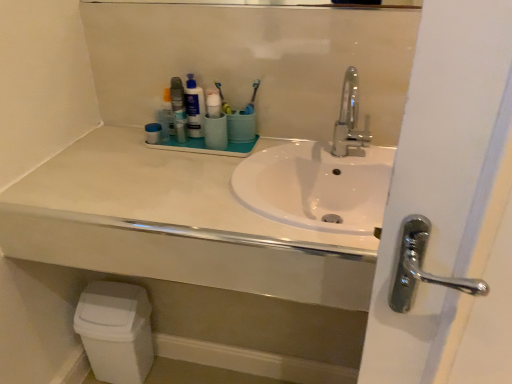
Where is `empty space that is ontop of white matte countertop at center (from a real-world perspective)`? The width and height of the screenshot is (512, 384). empty space that is ontop of white matte countertop at center (from a real-world perspective) is located at coordinates (188, 170).